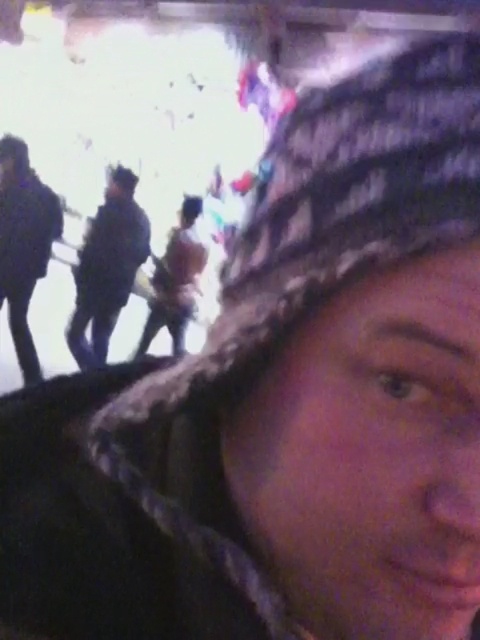
Question: Among these points, which one is farthest from the camera?

Choices:
 (A) (204, 266)
 (B) (120, 273)

Answer: (A)

Question: Which is nearer to the brown fuzzy coat at center?

Choices:
 (A) dark blue uniform at center
 (B) dark blue jacket at left

Answer: (A)

Question: Among these points, which one is farthest from the camera?

Choices:
 (A) (148, 314)
 (B) (15, 353)
 (C) (106, 189)

Answer: (C)

Question: Does dark blue uniform at center appear over brown fuzzy coat at center?

Choices:
 (A) yes
 (B) no

Answer: (A)

Question: Can you confirm if dark blue uniform at center is bigger than dark blue jacket at left?

Choices:
 (A) yes
 (B) no

Answer: (A)

Question: Can you confirm if dark blue jacket at left is positioned above brown fuzzy coat at center?

Choices:
 (A) yes
 (B) no

Answer: (A)